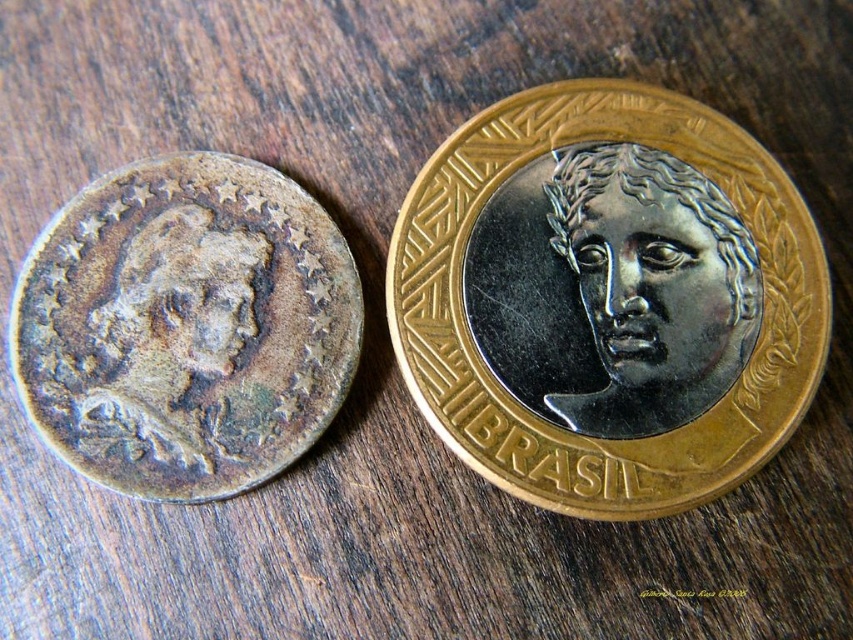
Question: Can you confirm if patina bronze coin at left is bigger than satin silver face at center?

Choices:
 (A) yes
 (B) no

Answer: (A)

Question: Which point is closer to the camera?

Choices:
 (A) patina bronze coin at left
 (B) satin silver face at center
 (C) gold-plated coin at center

Answer: (A)

Question: Which object appears farthest from the camera in this image?

Choices:
 (A) gold-plated coin at center
 (B) patina bronze coin at left

Answer: (A)

Question: Which object appears farthest from the camera in this image?

Choices:
 (A) gold-plated coin at center
 (B) satin silver face at center
 (C) patina bronze coin at left

Answer: (B)

Question: Does gold-plated coin at center appear on the left side of patina bronze coin at left?

Choices:
 (A) no
 (B) yes

Answer: (A)

Question: Does gold-plated coin at center come in front of satin silver face at center?

Choices:
 (A) no
 (B) yes

Answer: (B)